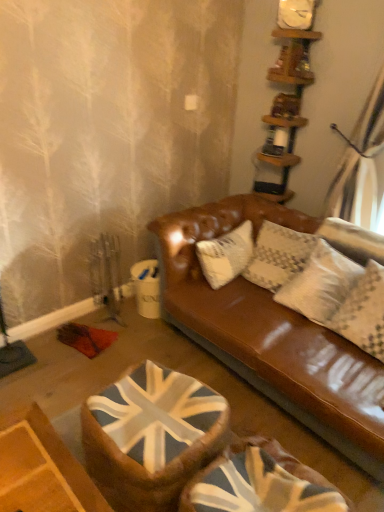
The image size is (384, 512). What are the coordinates of `free space above wooden shelves at upper right (from a real-world perspective)` in the screenshot? It's located at (297, 29).